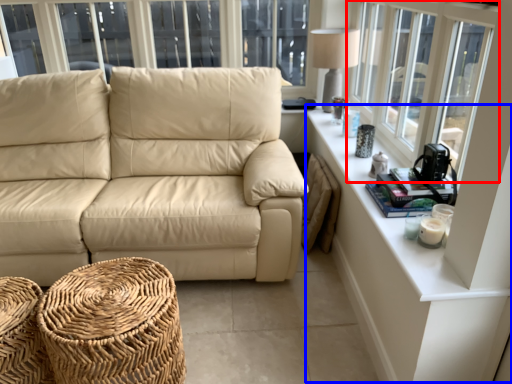
Question: Among these objects, which one is farthest to the camera, window (highlighted by a red box) or table (highlighted by a blue box)?

Choices:
 (A) window
 (B) table

Answer: (B)